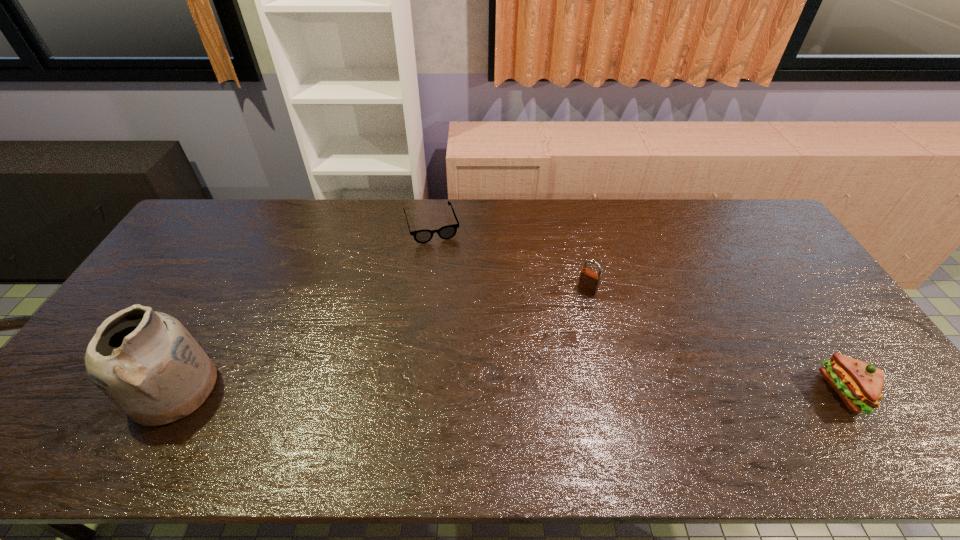
You are a GUI agent. You are given a task and a screenshot of the screen. Output one action in this format:
    pyautogui.click(x=<x>, y=<y>)
    Task: Click on the object positioned at the near left corner
    The height and width of the screenshot is (540, 960).
    Given the screenshot: What is the action you would take?
    pyautogui.click(x=147, y=363)

Find the location of `object that is at the near right corner`. object that is at the near right corner is located at coordinates (859, 384).

Locate an element on the screen. free space at the far edge is located at coordinates (567, 224).

Where is `blank space at the near edge of the desktop`? The width and height of the screenshot is (960, 540). blank space at the near edge of the desktop is located at coordinates (434, 409).

I want to click on vacant space at the right edge of the desktop, so click(782, 295).

Where is `vacant space at the far left corner of the desktop`? This screenshot has height=540, width=960. vacant space at the far left corner of the desktop is located at coordinates (242, 211).

The height and width of the screenshot is (540, 960). I want to click on free location at the far right corner, so click(759, 212).

This screenshot has height=540, width=960. What are the coordinates of `vacant space in between the leftmost object and the sandwich` in the screenshot? It's located at (511, 390).

Find the location of a particular element. The height and width of the screenshot is (540, 960). free space between the tallest object and the second farthest object is located at coordinates tap(381, 339).

This screenshot has width=960, height=540. What are the coordinates of `vacant region between the sandwich and the second object from left to right` in the screenshot? It's located at (639, 309).